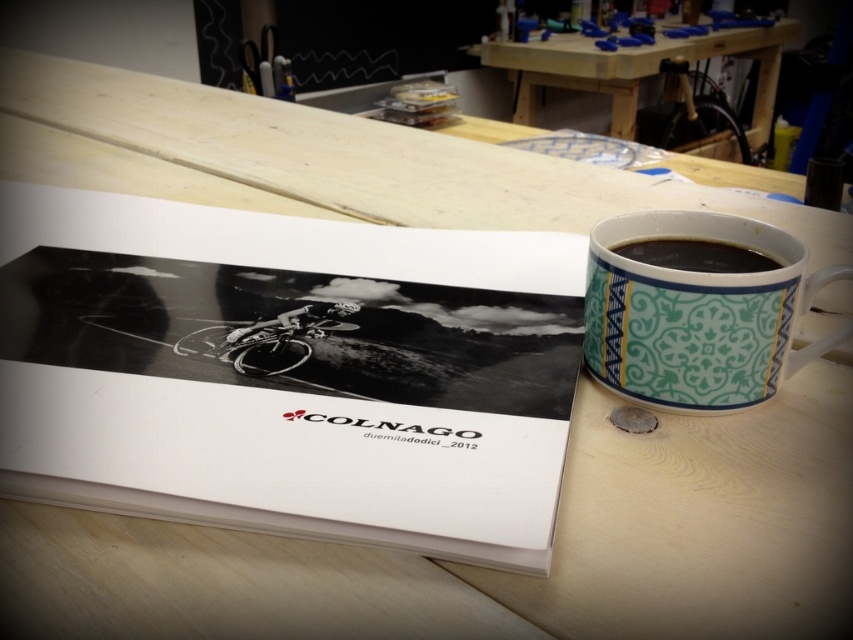
Question: Which point is closer to the camera?

Choices:
 (A) black glossy mug at upper right
 (B) wooden table at upper center

Answer: (A)

Question: Can you confirm if teal ceramic mug at right is positioned to the left of wooden table at upper center?

Choices:
 (A) yes
 (B) no

Answer: (A)

Question: Is white paper book at center smaller than wooden table at upper center?

Choices:
 (A) no
 (B) yes

Answer: (B)

Question: Can you confirm if white paper book at center is positioned below black glossy mug at upper right?

Choices:
 (A) yes
 (B) no

Answer: (A)

Question: Which of the following is the closest to the observer?

Choices:
 (A) (636, 276)
 (B) (643, 244)
 (C) (573, 56)
 (D) (547, 563)

Answer: (D)

Question: Among these objects, which one is farthest from the camera?

Choices:
 (A) teal ceramic mug at right
 (B) black glossy mug at upper right

Answer: (B)